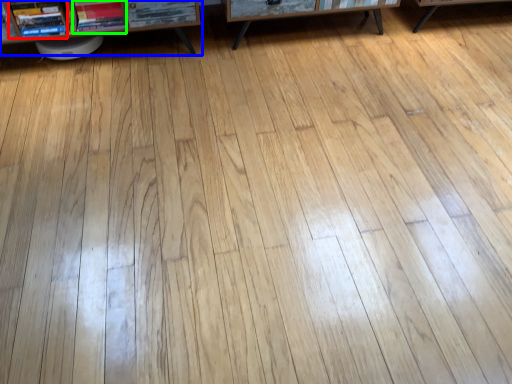
Question: Estimate the real-world distances between objects in this image. Which object is closer to book (highlighted by a red box), shelf (highlighted by a blue box) or book (highlighted by a green box)?

Choices:
 (A) shelf
 (B) book

Answer: (A)